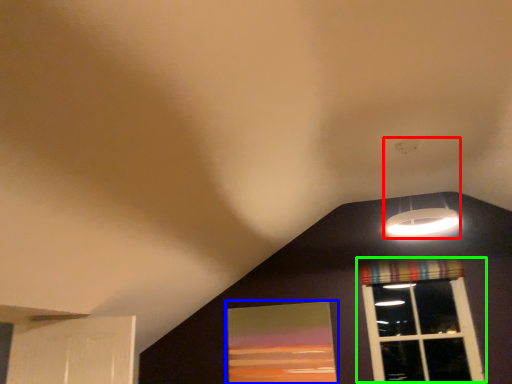
Question: Which object is positioned farthest from lamp (highlighted by a red box)? Select from window screen (highlighted by a blue box) and window (highlighted by a green box).

Choices:
 (A) window screen
 (B) window

Answer: (A)